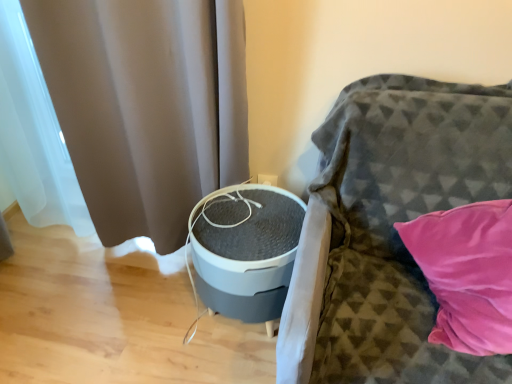
Question: From a real-world perspective, is textured gray sofa at right under matte gray curtain at left?

Choices:
 (A) no
 (B) yes

Answer: (B)

Question: Can matte gray curtain at left be found inside textured gray sofa at right?

Choices:
 (A) yes
 (B) no

Answer: (B)

Question: From the image's perspective, would you say textured gray sofa at right is shown under matte gray curtain at left?

Choices:
 (A) yes
 (B) no

Answer: (A)

Question: Considering the relative sizes of textured gray sofa at right and matte gray curtain at left in the image provided, is textured gray sofa at right bigger than matte gray curtain at left?

Choices:
 (A) yes
 (B) no

Answer: (A)

Question: Does textured gray sofa at right appear on the right side of matte gray curtain at left?

Choices:
 (A) yes
 (B) no

Answer: (A)

Question: Is the position of textured gray sofa at right more distant than that of matte gray curtain at left?

Choices:
 (A) yes
 (B) no

Answer: (B)

Question: Considering the relative positions of matte gray curtain at left and textured gray sofa at right in the image provided, is matte gray curtain at left behind textured gray sofa at right?

Choices:
 (A) yes
 (B) no

Answer: (A)

Question: From the image's perspective, is matte gray curtain at left below textured gray sofa at right?

Choices:
 (A) yes
 (B) no

Answer: (B)

Question: From a real-world perspective, is matte gray curtain at left on textured gray sofa at right?

Choices:
 (A) yes
 (B) no

Answer: (A)

Question: From a real-world perspective, is matte gray curtain at left positioned under textured gray sofa at right based on gravity?

Choices:
 (A) yes
 (B) no

Answer: (B)

Question: Could you tell me if matte gray curtain at left is turned towards textured gray sofa at right?

Choices:
 (A) no
 (B) yes

Answer: (A)

Question: Is matte gray curtain at left bigger than textured gray sofa at right?

Choices:
 (A) yes
 (B) no

Answer: (B)

Question: From a real-world perspective, is textured gray sofa at right physically located above or below matte gray curtain at left?

Choices:
 (A) above
 (B) below

Answer: (B)